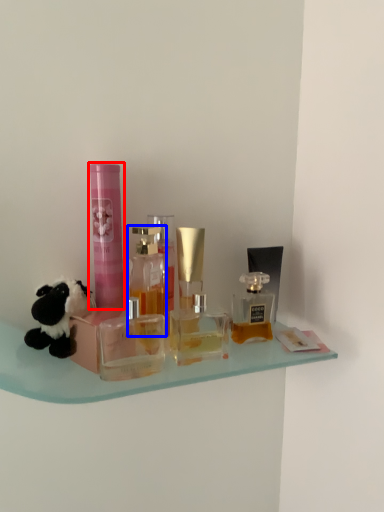
Question: Among these objects, which one is nearest to the camera, toiletry (highlighted by a red box) or bottle (highlighted by a blue box)?

Choices:
 (A) toiletry
 (B) bottle

Answer: (B)